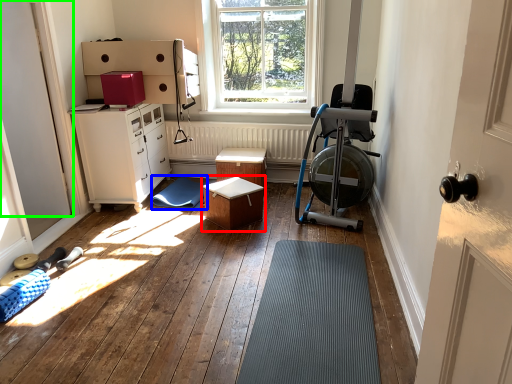
Question: Which is nearer to the table (highlighted by a red box)? mat (highlighted by a blue box) or door (highlighted by a green box).

Choices:
 (A) mat
 (B) door

Answer: (A)